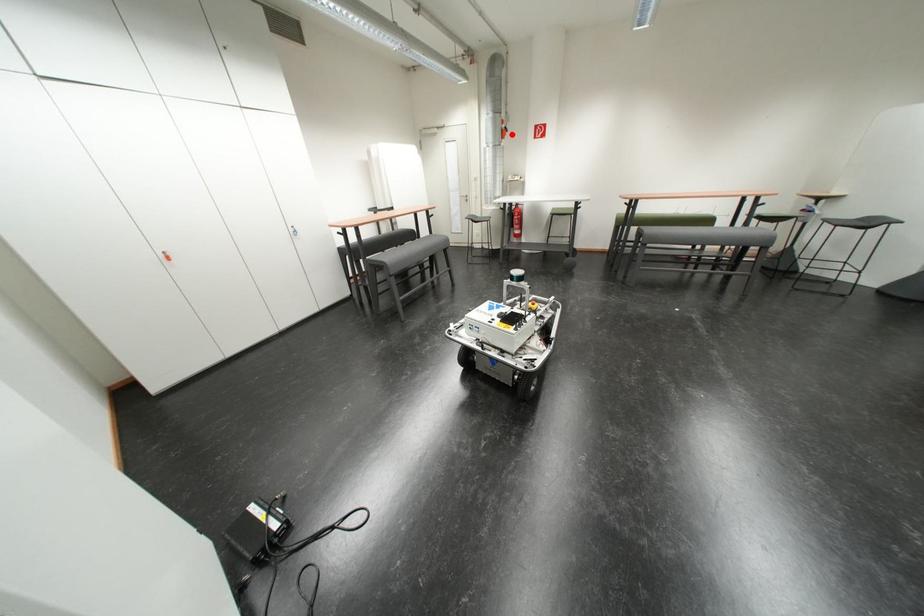
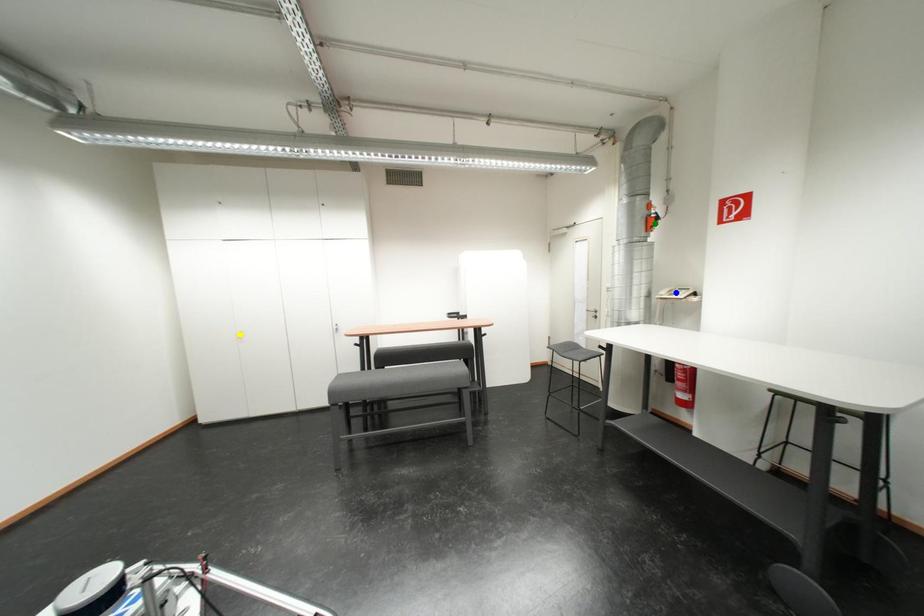
Question: I am providing you with two images of the same scene from different viewpoints. A red point is marked on the first image. You are given multiple points on the second image. Which point in image 2 represents the same 3d spot as the red point in image 1?

Choices:
 (A) blue point
 (B) green point
 (C) yellow point

Answer: (B)